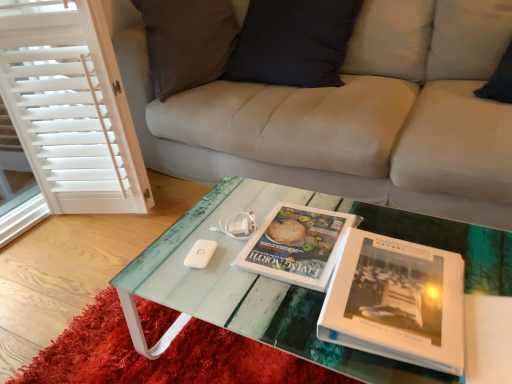
What do you see at coordinates (397, 302) in the screenshot?
I see `white glossy book at center, which is the second book from back to front` at bounding box center [397, 302].

Image resolution: width=512 pixels, height=384 pixels. What do you see at coordinates (163, 355) in the screenshot?
I see `translucent glass table at center` at bounding box center [163, 355].

What is the approximate width of white matte game controller at center?

It is 10.87 centimeters.

Measure the distance between point (278, 333) and camera.

32.91 inches.

What do you see at coordinates (297, 245) in the screenshot?
I see `matte white book at center, the second book in the front-to-back sequence` at bounding box center [297, 245].

You are a GUI agent. You are given a task and a screenshot of the screen. Output one action in this format:
    pyautogui.click(x=<x>, y=<y>)
    Task: Click on the matte white book at center, the first book positioned from the back
    
    Given the screenshot: What is the action you would take?
    pos(297,245)

What is the approximate height of white wood screen door at left?

87.28 centimeters.

The height and width of the screenshot is (384, 512). I want to click on white glossy book at center, the 1th book positioned from the front, so click(x=397, y=302).

Is translucent glass coffee table at center to the left or to the right of white matte game controller at center in the image?

Based on their positions, translucent glass coffee table at center is located to the right of white matte game controller at center.

Is translucent glass coffee table at center next to white matte game controller at center?

No, translucent glass coffee table at center is not in contact with white matte game controller at center.

Looking at this image, from a real-world perspective, who is located higher, translucent glass coffee table at center or white matte game controller at center?

From a 3D spatial view, white matte game controller at center is above.

Considering the relative sizes of white matte game controller at center and matte white book at center, the second book in the front-to-back sequence, in the image provided, is white matte game controller at center wider than matte white book at center, the second book in the front-to-back sequence,?

In fact, white matte game controller at center might be narrower than matte white book at center, the second book in the front-to-back sequence.

Is matte white book at center, the first book positioned from the back, located within white matte game controller at center?

Actually, matte white book at center, the first book positioned from the back, is outside white matte game controller at center.

You are a GUI agent. You are given a task and a screenshot of the screen. Output one action in this format:
    pyautogui.click(x=<x>, y=<y>)
    Task: Click on the book below the white matte game controller at center (from a real-world perspective)
    This screenshot has height=384, width=512.
    Given the screenshot: What is the action you would take?
    pyautogui.click(x=297, y=245)

Is white matte game controller at center at the left side of matte white book at center, the first book positioned from the back?

Yes.

Is translucent glass coffee table at center oriented towards white wood screen door at left?

No, translucent glass coffee table at center is not facing towards white wood screen door at left.

Considering the sizes of translucent glass coffee table at center and white wood screen door at left in the image, is translucent glass coffee table at center taller or shorter than white wood screen door at left?

In the image, translucent glass coffee table at center appears to be shorter than white wood screen door at left.

Is translucent glass coffee table at center spatially inside white wood screen door at left, or outside of it?

translucent glass coffee table at center is located beyond the bounds of white wood screen door at left.

How distant is white matte game controller at center from white glossy book at center, which is the second book from back to front?

15.57 inches.

Based on the photo, which object is thinner, white matte game controller at center or white glossy book at center, which is the second book from back to front?

white matte game controller at center.

Looking at this image, is the surface of white matte game controller at center in direct contact with white glossy book at center, the 1th book positioned from the front?

Result: No, white matte game controller at center is not beside white glossy book at center, the 1th book positioned from the front.

Which of these two, white wood screen door at left or matte white book at center, the second book in the front-to-back sequence, stands shorter?

matte white book at center, the second book in the front-to-back sequence.

Relative to matte white book at center, the first book positioned from the back, is white wood screen door at left in front or behind?

Clearly, white wood screen door at left is behind matte white book at center, the first book positioned from the back.

Could you tell me if white wood screen door at left is facing matte white book at center, the second book in the front-to-back sequence?

No, white wood screen door at left is not oriented towards matte white book at center, the second book in the front-to-back sequence.

Can matte white book at center, the first book positioned from the back, be found inside white wood screen door at left?

That's incorrect, matte white book at center, the first book positioned from the back, is not inside white wood screen door at left.

Is translucent glass table at center positioned with its back to translucent glass coffee table at center?

Yes.

Locate an element on the screen. This screenshot has height=384, width=512. coffee table above the translucent glass table at center (from the image's perspective) is located at coordinates (294, 285).

Considering the relative sizes of translucent glass table at center and translucent glass coffee table at center in the image provided, is translucent glass table at center bigger than translucent glass coffee table at center?

Actually, translucent glass table at center might be smaller than translucent glass coffee table at center.

Choose the correct answer: Is matte white book at center, the first book positioned from the back, inside white matte game controller at center or outside it?

The correct answer is: outside.

Considering the relative positions of matte white book at center, the first book positioned from the back, and white matte game controller at center in the image provided, is matte white book at center, the first book positioned from the back, in front of white matte game controller at center?

Yes, the depth of matte white book at center, the first book positioned from the back, is less than that of white matte game controller at center.

In the scene shown: In terms of width, does matte white book at center, the first book positioned from the back, look wider or thinner when compared to white matte game controller at center?

matte white book at center, the first book positioned from the back, is wider than white matte game controller at center.

Where is `book below the white matte game controller at center (from a real-world perspective)`? This screenshot has width=512, height=384. book below the white matte game controller at center (from a real-world perspective) is located at coordinates (297, 245).

At what (x,y) coordinates should I click in order to perform the action: click on coffee table on the right of white matte game controller at center. Please return your answer as a coordinate pair (x, y). Looking at the image, I should click on (294, 285).

Image resolution: width=512 pixels, height=384 pixels. Find the location of `game controller located above the matte white book at center, the first book positioned from the back (from the image's perspective)`. game controller located above the matte white book at center, the first book positioned from the back (from the image's perspective) is located at coordinates (238, 225).

Estimate the real-world distances between objects in this image. Which object is closer to white glossy book at center, which is the second book from back to front, translucent glass table at center or white matte game controller at center?

translucent glass table at center is closer to white glossy book at center, which is the second book from back to front.

Based on their spatial positions, is white matte game controller at center or matte white book at center, the first book positioned from the back, closer to translucent glass table at center?

matte white book at center, the first book positioned from the back, is positioned closer to the anchor translucent glass table at center.

From the image, which object appears to be nearer to matte white book at center, the second book in the front-to-back sequence, white glossy book at center, which is the second book from back to front, or white matte game controller at center?

white matte game controller at center is closer to matte white book at center, the second book in the front-to-back sequence.

Considering their positions, is white wood screen door at left positioned closer to translucent glass table at center than translucent glass coffee table at center?

translucent glass coffee table at center.

Looking at this image, considering their positions, is translucent glass table at center positioned closer to matte white book at center, the second book in the front-to-back sequence, than white wood screen door at left?

translucent glass table at center is positioned closer to the anchor matte white book at center, the second book in the front-to-back sequence.

Considering their positions, is matte white book at center, the second book in the front-to-back sequence, positioned closer to translucent glass table at center than white glossy book at center, the 1th book positioned from the front?

The object closer to translucent glass table at center is matte white book at center, the second book in the front-to-back sequence.

Looking at the image, which one is located further to translucent glass coffee table at center, matte white book at center, the first book positioned from the back, or translucent glass table at center?

Among the two, translucent glass table at center is located further to translucent glass coffee table at center.

When comparing their distances from white wood screen door at left, does translucent glass coffee table at center or matte white book at center, the first book positioned from the back, seem further?

matte white book at center, the first book positioned from the back.

Where is `game controller located between white wood screen door at left and translucent glass coffee table at center in the left-right direction`? The width and height of the screenshot is (512, 384). game controller located between white wood screen door at left and translucent glass coffee table at center in the left-right direction is located at coordinates (238, 225).

The width and height of the screenshot is (512, 384). Identify the location of book between white wood screen door at left and white glossy book at center, which is the second book from back to front, from left to right. (297, 245).

Find the location of a particular element. The width and height of the screenshot is (512, 384). game controller between white wood screen door at left and translucent glass table at center in the up-down direction is located at coordinates (238, 225).

Image resolution: width=512 pixels, height=384 pixels. Identify the location of coffee table situated between white wood screen door at left and white glossy book at center, which is the second book from back to front, from left to right. (294, 285).